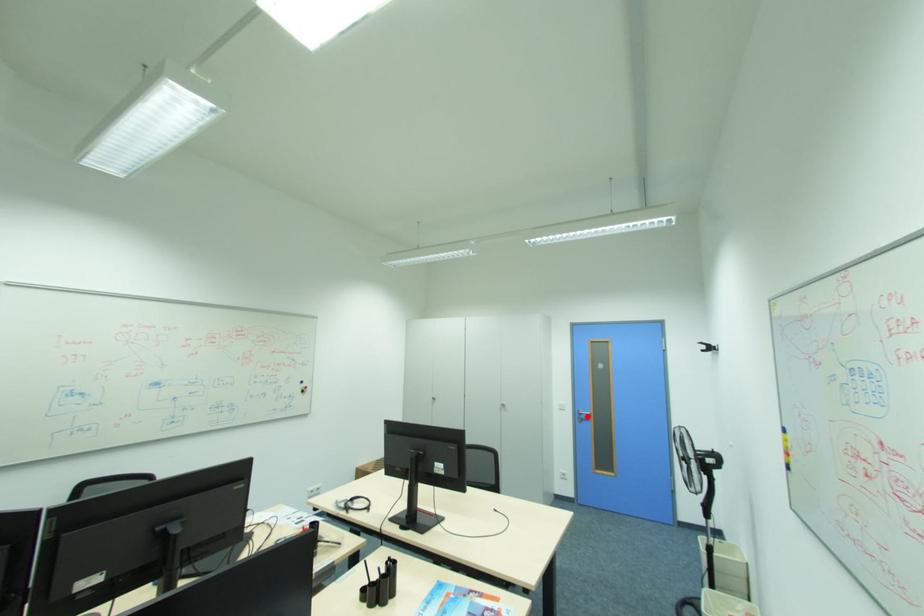
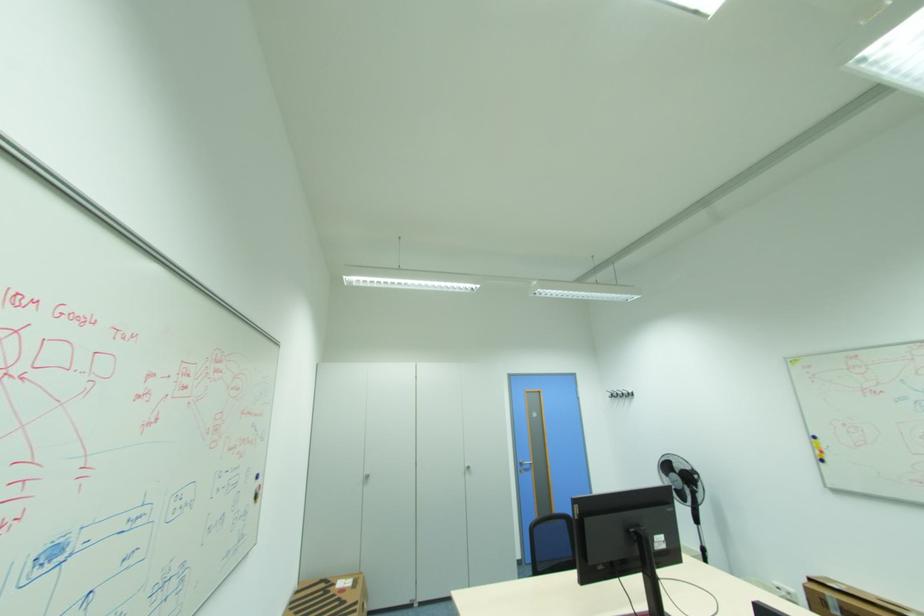
Locate, in the second image, the point that corresponds to the highlighted location in the first image.

(529, 467)